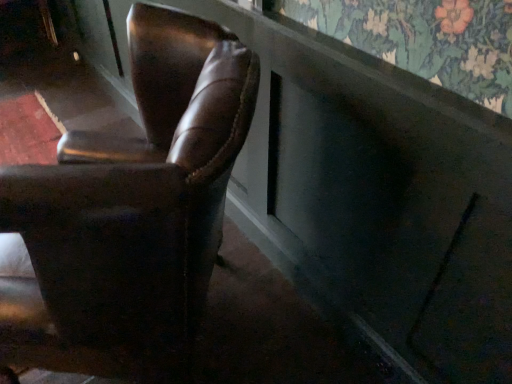
Image resolution: width=512 pixels, height=384 pixels. Identify the location of brown leather chair at left. (126, 242).

Measure the distance between brown leather chair at left and camera.

The distance of brown leather chair at left from camera is 25.00 inches.

What do you see at coordinates (126, 242) in the screenshot? The width and height of the screenshot is (512, 384). I see `brown leather chair at left` at bounding box center [126, 242].

Identify the location of brown leather chair at left. (126, 242).